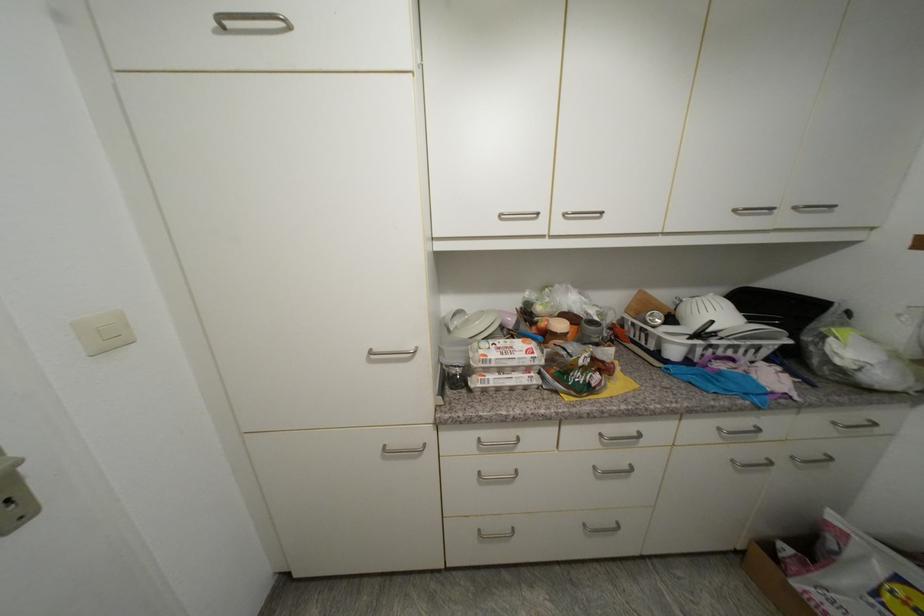
Locate an element on the screen. wooden cutting board is located at coordinates (643, 305).